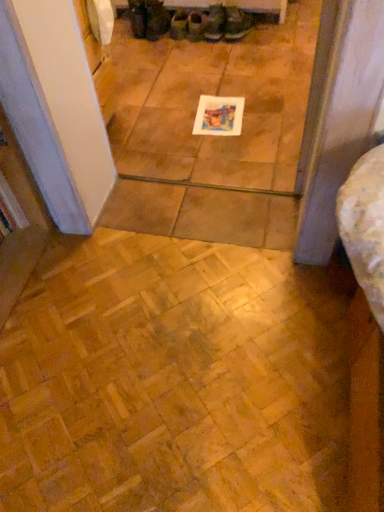
You are a GUI agent. You are given a task and a screenshot of the screen. Output one action in this format:
    pyautogui.click(x=<x>, y=<y>)
    Task: Click on the vacant space that is in between white paper at center and matte green fabric shoe at center, marked as the fourth footwear in a left-to-right arrangement
    
    Given the screenshot: What is the action you would take?
    pyautogui.click(x=214, y=79)